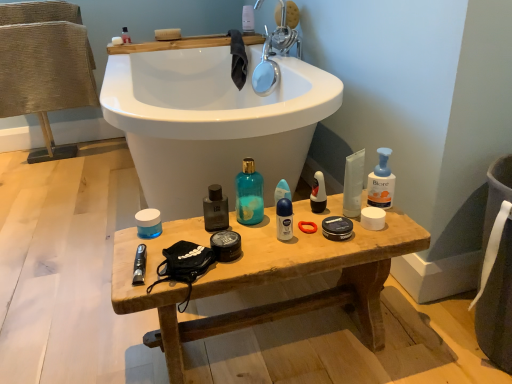
The width and height of the screenshot is (512, 384). I want to click on free space to the left of blue matte deodorant stick at center, which is the second toiletry in right-to-left order, so click(x=233, y=221).